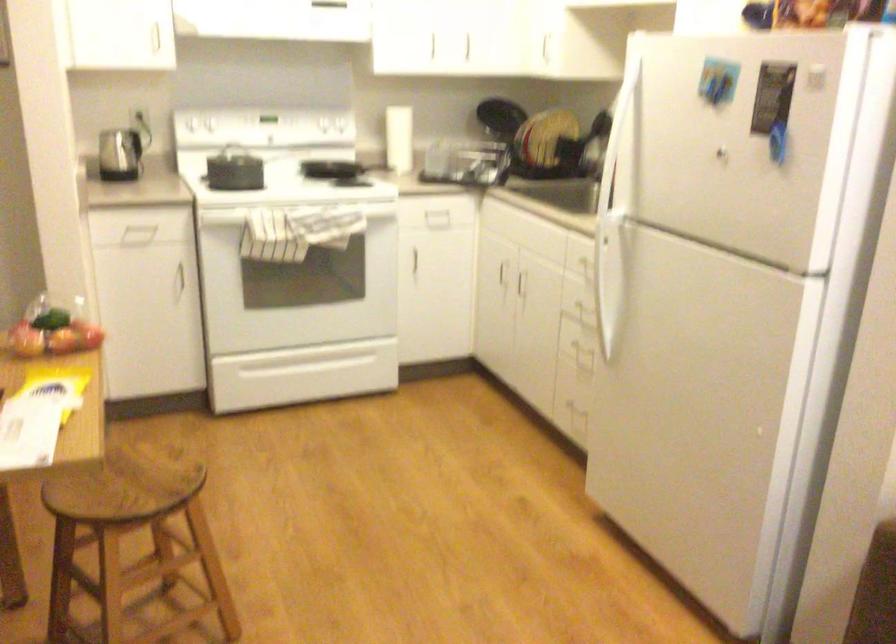
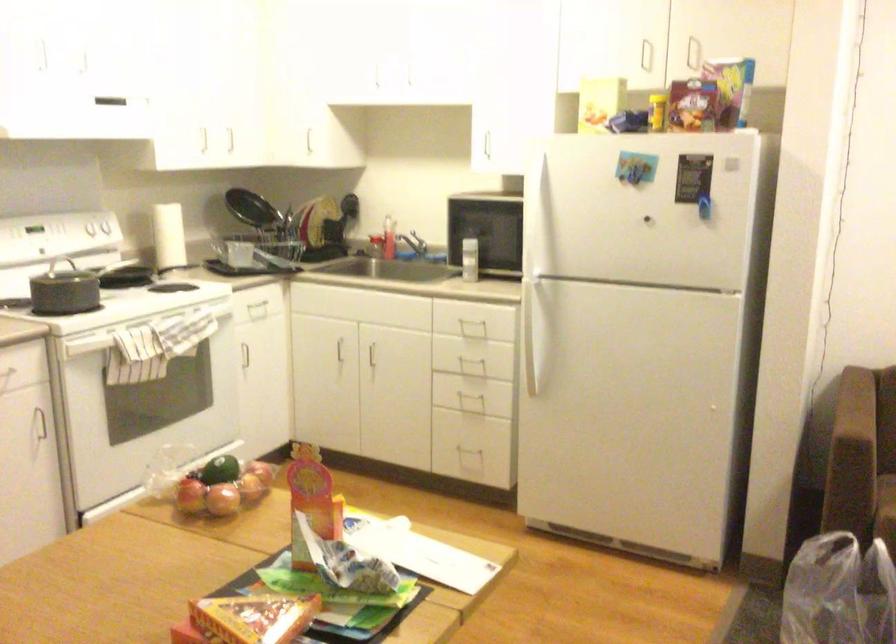
Where in the second image is the point corresponding to [374,126] from the first image?

(168, 236)